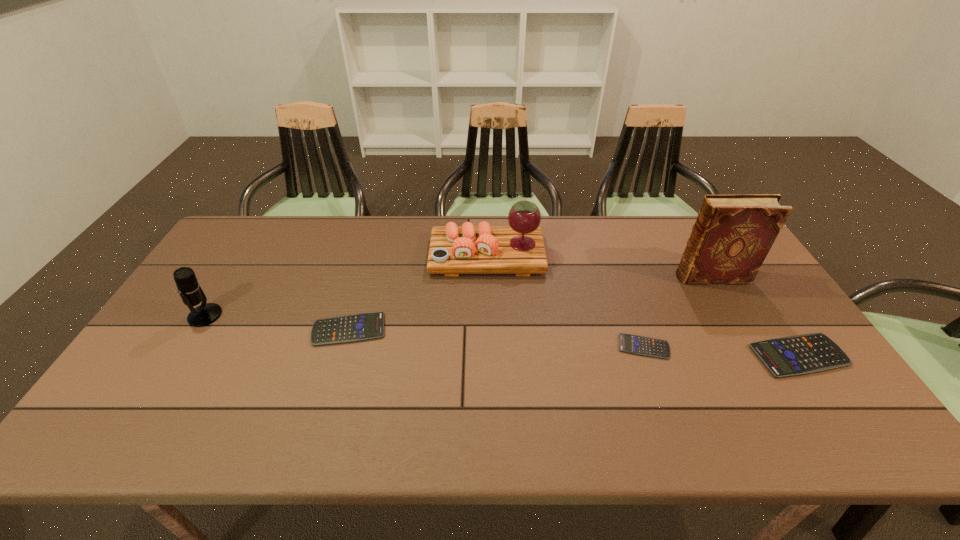
You are a GUI agent. You are given a task and a screenshot of the screen. Output one action in this format:
    pyautogui.click(x=<x>, y=<y>)
    Task: Click on the third closest calculator relative to the hardback book
    This screenshot has height=540, width=960.
    Given the screenshot: What is the action you would take?
    [x=358, y=327]

Identify the location of vacant region that satisfies the following two spatial constraints: 1. on the spine side of the tallest object; 2. on the front side of the leftmost object. (734, 315).